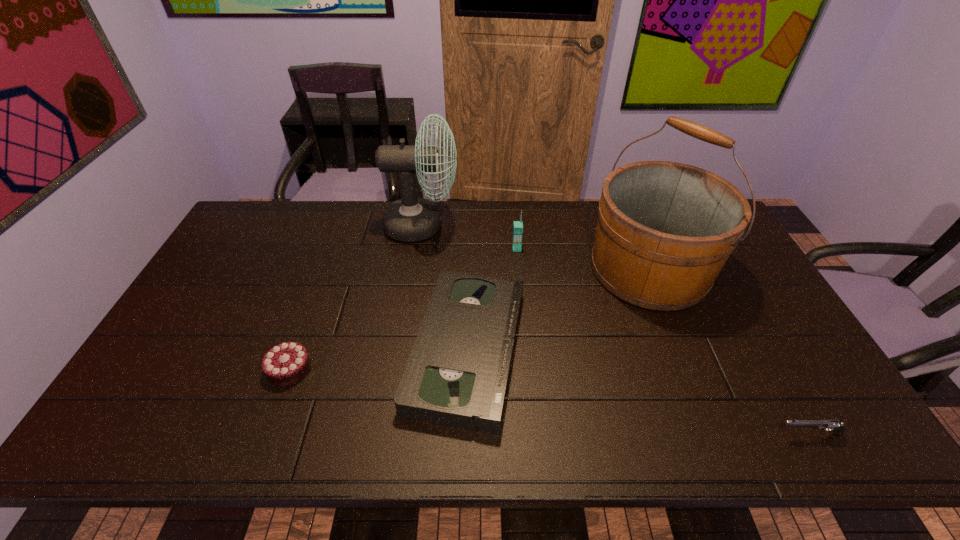
Identify the location of vacant position located on the left of the videotape. (263, 349).

The image size is (960, 540). In order to click on vacant area situated on the front-facing side of the pistol in this screenshot , I will do `click(701, 434)`.

Locate an element on the screen. The image size is (960, 540). free location located on the front-facing side of the pistol is located at coordinates (732, 434).

This screenshot has height=540, width=960. Identify the location of free space located 0.100m on the front-facing side of the pistol. (732, 434).

At what (x,y) coordinates should I click in order to perform the action: click on bucket at the far edge. Please return your answer as a coordinate pair (x, y). Looking at the image, I should click on (665, 230).

At what (x,y) coordinates should I click in order to perform the action: click on fan at the far edge. Please return your answer as a coordinate pair (x, y). The height and width of the screenshot is (540, 960). Looking at the image, I should click on (410, 219).

The width and height of the screenshot is (960, 540). Find the location of `videotape at the near edge`. videotape at the near edge is located at coordinates (457, 374).

The width and height of the screenshot is (960, 540). I want to click on pistol positioned at the near edge, so click(837, 427).

At what (x,y) coordinates should I click in order to perform the action: click on bucket that is at the right edge. Please return your answer as a coordinate pair (x, y). The height and width of the screenshot is (540, 960). Looking at the image, I should click on (665, 230).

Find the location of a particular element. pistol that is at the right edge is located at coordinates (837, 427).